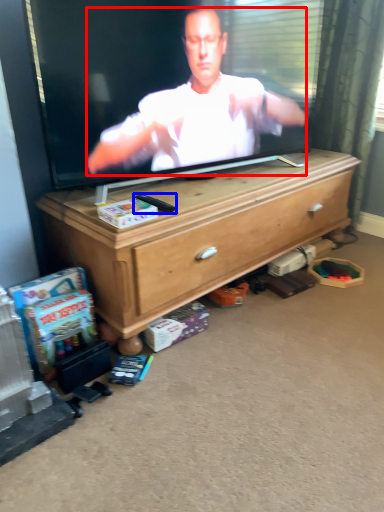
Question: Which of the following is the closest to the observer, person (highlighted by a red box) or remote control (highlighted by a blue box)?

Choices:
 (A) person
 (B) remote control

Answer: (A)